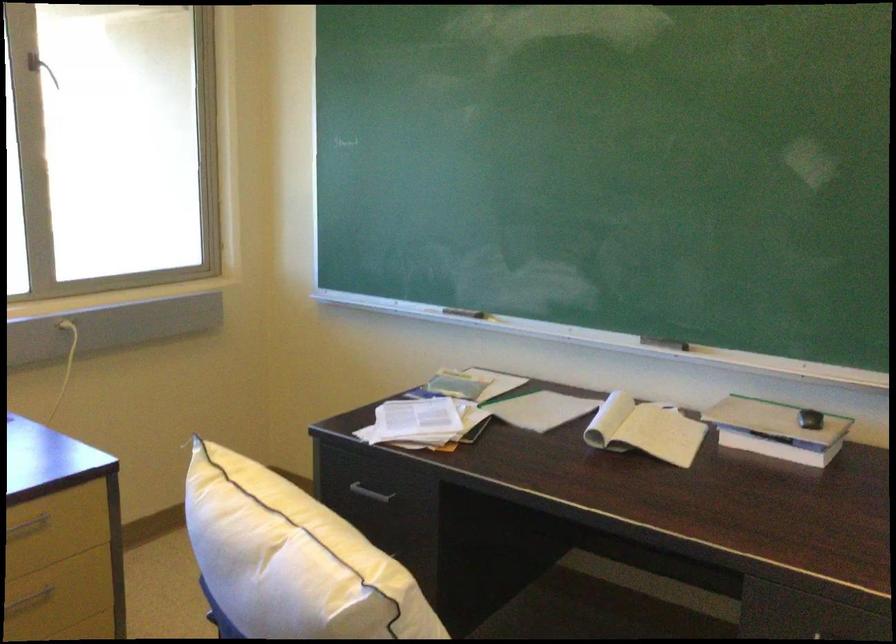
This screenshot has width=896, height=644. What do you see at coordinates (28, 526) in the screenshot?
I see `the dark drawer handle` at bounding box center [28, 526].